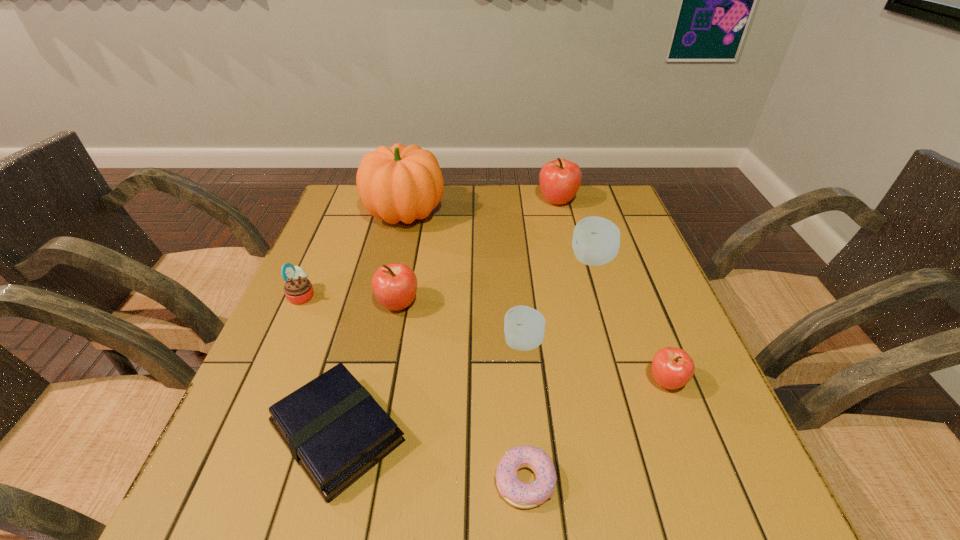
You are a GUI agent. You are given a task and a screenshot of the screen. Output one action in this format:
    pyautogui.click(x=<x>, y=<y>)
    Task: Click on the orange pumpkin
    This screenshot has width=960, height=540.
    Given the screenshot: What is the action you would take?
    pyautogui.click(x=400, y=183)

What are the coordinates of `the tallest object` in the screenshot? It's located at (400, 183).

Where is `the biggest pink apple`? the biggest pink apple is located at coordinates click(x=560, y=179).

Locate an element on the screen. the second pink apple from right to left is located at coordinates (560, 179).

I want to click on the farther white apple, so click(596, 240).

The image size is (960, 540). Identify the location of the right white apple. (x=596, y=240).

This screenshot has height=540, width=960. In order to click on the leftmost apple in this screenshot , I will do `click(394, 285)`.

The height and width of the screenshot is (540, 960). Identify the location of the second biggest pink apple. (394, 285).

I want to click on muffin, so [298, 289].

In order to click on the leftmost object in this screenshot , I will do `click(298, 289)`.